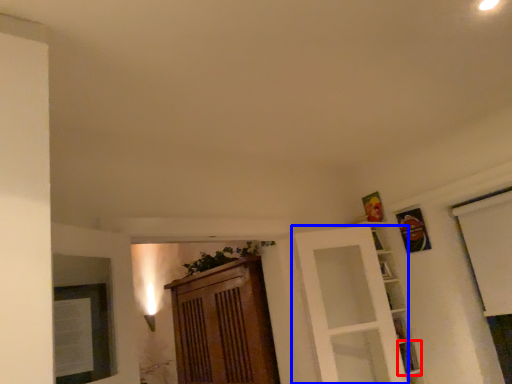
Question: Among these objects, which one is nearest to the camera, shelf (highlighted by a red box) or door (highlighted by a blue box)?

Choices:
 (A) shelf
 (B) door

Answer: (B)